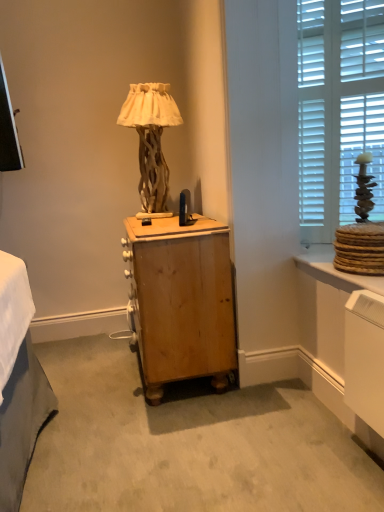
What do you see at coordinates (151, 139) in the screenshot?
I see `wooden textured lamp at center` at bounding box center [151, 139].

The height and width of the screenshot is (512, 384). Describe the element at coordinates (338, 109) in the screenshot. I see `white wood blinds at upper right` at that location.

Locate an element on the screen. matte wood vanity at lower right is located at coordinates (332, 304).

Locate an element on the screen. This screenshot has width=384, height=512. wooden textured lamp at center is located at coordinates [x=151, y=139].

In the scene shown: Who is taller, wooden nightstand at center or wooden textured lamp at center?

Standing taller between the two is wooden nightstand at center.

Is wooden nightstand at center looking in the opposite direction of wooden textured lamp at center?

No, wooden nightstand at center is not facing away from wooden textured lamp at center.

Between wooden nightstand at center and wooden textured lamp at center, which one has larger width?

Wider between the two is wooden nightstand at center.

Is wooden nightstand at center not close to wooden textured lamp at center?

They are positioned close to each other.

Which is behind, point (342, 357) or point (361, 110)?

Point (361, 110)

Considering the relative sizes of matte wood vanity at lower right and white wood blinds at upper right in the image provided, is matte wood vanity at lower right bigger than white wood blinds at upper right?

No.

Is the position of matte wood vanity at lower right less distant than that of white wood blinds at upper right?

Yes, the depth of matte wood vanity at lower right is less than that of white wood blinds at upper right.

Is matte wood vanity at lower right inside the boundaries of white wood blinds at upper right, or outside?

matte wood vanity at lower right is outside white wood blinds at upper right.

Considering the relative sizes of matte wood vanity at lower right and wooden textured lamp at center in the image provided, is matte wood vanity at lower right wider than wooden textured lamp at center?

No.

In the image, is matte wood vanity at lower right positioned in front of or behind wooden textured lamp at center?

matte wood vanity at lower right is positioned closer to the viewer than wooden textured lamp at center.

Looking at this image, is matte wood vanity at lower right next to wooden textured lamp at center?

No.

Which of these two, matte wood vanity at lower right or wooden textured lamp at center, is bigger?

Bigger between the two is wooden textured lamp at center.

Which is closer to the camera, [363,430] or [168,318]?

Point [363,430] is positioned closer to the camera compared to point [168,318].

Can you tell me how much matte wood vanity at lower right and wooden nightstand at center differ in facing direction?

The facing directions of matte wood vanity at lower right and wooden nightstand at center are 1.16 degrees apart.

Are matte wood vanity at lower right and wooden nightstand at center located far from each other?

No.

From a real-world perspective, is matte wood vanity at lower right under wooden nightstand at center?

Yes, from a real-world perspective, matte wood vanity at lower right is beneath wooden nightstand at center.

From a real-world perspective, who is located higher, wooden textured lamp at center or white wood blinds at upper right?

In real-world perspective, white wood blinds at upper right is above.

Is wooden textured lamp at center in front of white wood blinds at upper right?

No.

Can you confirm if wooden textured lamp at center is positioned to the left of white wood blinds at upper right?

Correct, you'll find wooden textured lamp at center to the left of white wood blinds at upper right.

Can you tell me how much wooden textured lamp at center and white wood blinds at upper right differ in facing direction?

There is a 56.8-degree angle between the facing directions of wooden textured lamp at center and white wood blinds at upper right.

Considering the sizes of objects wooden textured lamp at center and matte wood vanity at lower right in the image provided, who is smaller, wooden textured lamp at center or matte wood vanity at lower right?

With smaller size is matte wood vanity at lower right.

Is wooden textured lamp at center positioned beyond the bounds of matte wood vanity at lower right?

Absolutely, wooden textured lamp at center is external to matte wood vanity at lower right.

Does point (139, 146) come closer to viewer compared to point (361, 279)?

No.

Is white wood blinds at upper right looking in the opposite direction of wooden textured lamp at center?

That's not correct — white wood blinds at upper right is not looking away from wooden textured lamp at center.

Is wooden textured lamp at center a part of white wood blinds at upper right?

No, wooden textured lamp at center is located outside of white wood blinds at upper right.

From the image's perspective, who appears lower, white wood blinds at upper right or wooden textured lamp at center?

From the image's view, wooden textured lamp at center is below.

Is white wood blinds at upper right behind wooden textured lamp at center?

That is False.

Locate an element on the screen. Image resolution: width=384 pixels, height=512 pixels. nightstand in front of the wooden textured lamp at center is located at coordinates (180, 301).

This screenshot has width=384, height=512. In order to click on window that is behind the matte wood vanity at lower right in this screenshot , I will do `click(338, 109)`.

Estimate the real-world distances between objects in this image. Which object is further from wooden nightstand at center, matte wood vanity at lower right or wooden textured lamp at center?

Based on the image, wooden textured lamp at center appears to be further to wooden nightstand at center.

Based on their spatial positions, is wooden nightstand at center or wooden textured lamp at center further from white wood blinds at upper right?

wooden textured lamp at center lies further to white wood blinds at upper right than the other object.

Which object lies further to the anchor point wooden nightstand at center, wooden textured lamp at center or matte wood vanity at lower right?

wooden textured lamp at center is positioned further to the anchor wooden nightstand at center.

Based on the photo, estimate the real-world distances between objects in this image. Which object is further from white wood blinds at upper right, wooden textured lamp at center or wooden nightstand at center?

Based on the image, wooden textured lamp at center appears to be further to white wood blinds at upper right.

Which object lies nearer to the anchor point wooden textured lamp at center, matte wood vanity at lower right or wooden nightstand at center?

wooden nightstand at center is positioned closer to the anchor wooden textured lamp at center.

Considering their positions, is wooden nightstand at center positioned further to wooden textured lamp at center than matte wood vanity at lower right?

Among the two, matte wood vanity at lower right is located further to wooden textured lamp at center.

In the scene shown: Based on their spatial positions, is wooden nightstand at center or white wood blinds at upper right further from matte wood vanity at lower right?

The object further to matte wood vanity at lower right is white wood blinds at upper right.

Based on their spatial positions, is white wood blinds at upper right or wooden textured lamp at center further from matte wood vanity at lower right?

The object further to matte wood vanity at lower right is wooden textured lamp at center.

This screenshot has height=512, width=384. Find the location of `nightstand between wooden textured lamp at center and white wood blinds at upper right in the horizontal direction`. nightstand between wooden textured lamp at center and white wood blinds at upper right in the horizontal direction is located at coordinates (180, 301).

Find the location of a particular element. This screenshot has height=512, width=384. nightstand between white wood blinds at upper right and matte wood vanity at lower right vertically is located at coordinates (180, 301).

This screenshot has height=512, width=384. Identify the location of table lamp that lies between white wood blinds at upper right and matte wood vanity at lower right from top to bottom. (151, 139).

In order to click on nightstand that lies between wooden textured lamp at center and matte wood vanity at lower right from top to bottom in this screenshot , I will do `click(180, 301)`.